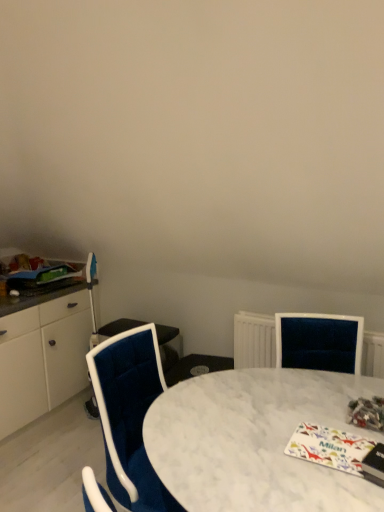
Question: Considering the positions of point (26, 276) and point (160, 492), is point (26, 276) closer or farther from the camera than point (160, 492)?

Choices:
 (A) closer
 (B) farther

Answer: (B)

Question: From a real-world perspective, is matte green magazine at left, placed as the third magazine when sorted from bottom to top, above or below velvet blue chair at center?

Choices:
 (A) above
 (B) below

Answer: (A)

Question: Based on their relative distances, which object is farther from the white marble table at center?

Choices:
 (A) matte green magazine at left, the 1th magazine viewed from the back
 (B) white glossy magazine at lower right, the 1th magazine positioned from the bottom
 (C) multicolored glossy magazine at lower right, which is counted as the second magazine, starting from the bottom
 (D) velvet blue chair at center

Answer: (A)

Question: Based on their relative distances, which object is farther from the multicolored glossy magazine at lower right, arranged as the 3th magazine when viewed from the left?

Choices:
 (A) matte green magazine at left, the 1th magazine viewed from the back
 (B) white glossy magazine at lower right, the 2th magazine when ordered from left to right
 (C) white marble table at center
 (D) velvet blue chair at center

Answer: (A)